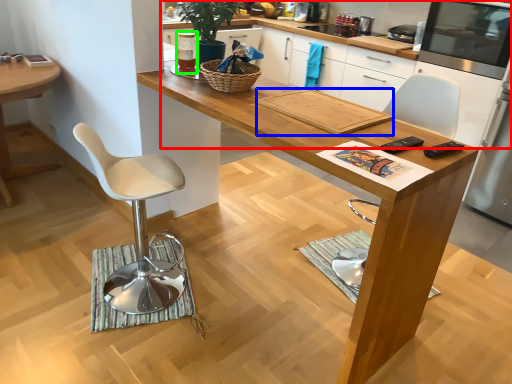
Question: Which object is the farthest from cabinetry (highlighted by a red box)? Choose among these: magazine (highlighted by a blue box) or appliance (highlighted by a green box).

Choices:
 (A) magazine
 (B) appliance

Answer: (A)